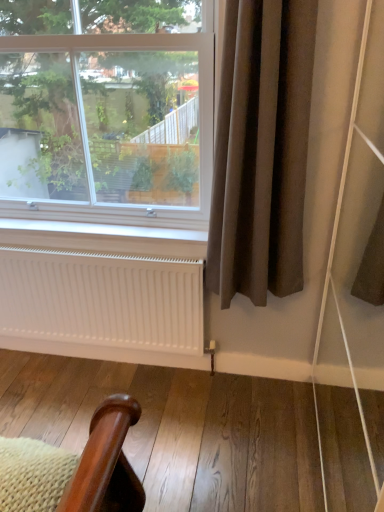
Question: Does clear glass window at upper left have a greater width compared to brown fabric curtain at right?

Choices:
 (A) yes
 (B) no

Answer: (A)

Question: From a real-world perspective, is clear glass window at upper left physically below brown fabric curtain at right?

Choices:
 (A) no
 (B) yes

Answer: (A)

Question: Considering the relative sizes of clear glass window at upper left and brown fabric curtain at right in the image provided, is clear glass window at upper left thinner than brown fabric curtain at right?

Choices:
 (A) no
 (B) yes

Answer: (A)

Question: Is the depth of clear glass window at upper left less than that of brown fabric curtain at right?

Choices:
 (A) no
 (B) yes

Answer: (A)

Question: From the image's perspective, would you say clear glass window at upper left is positioned over brown fabric curtain at right?

Choices:
 (A) no
 (B) yes

Answer: (B)

Question: Is clear glass window at upper left positioned behind brown fabric curtain at right?

Choices:
 (A) yes
 (B) no

Answer: (A)

Question: Can you confirm if brown fabric curtain at right is shorter than clear glass window at upper left?

Choices:
 (A) no
 (B) yes

Answer: (A)

Question: Is brown fabric curtain at right not inside clear glass window at upper left?

Choices:
 (A) yes
 (B) no

Answer: (A)

Question: Can you confirm if brown fabric curtain at right is smaller than clear glass window at upper left?

Choices:
 (A) yes
 (B) no

Answer: (A)

Question: Does brown fabric curtain at right appear on the left side of clear glass window at upper left?

Choices:
 (A) yes
 (B) no

Answer: (B)

Question: From the image's perspective, is brown fabric curtain at right below clear glass window at upper left?

Choices:
 (A) yes
 (B) no

Answer: (A)

Question: Can you confirm if brown fabric curtain at right is positioned to the right of clear glass window at upper left?

Choices:
 (A) no
 (B) yes

Answer: (B)

Question: Does white matte radiator at lower center have a lesser width compared to brown fabric curtain at right?

Choices:
 (A) yes
 (B) no

Answer: (A)